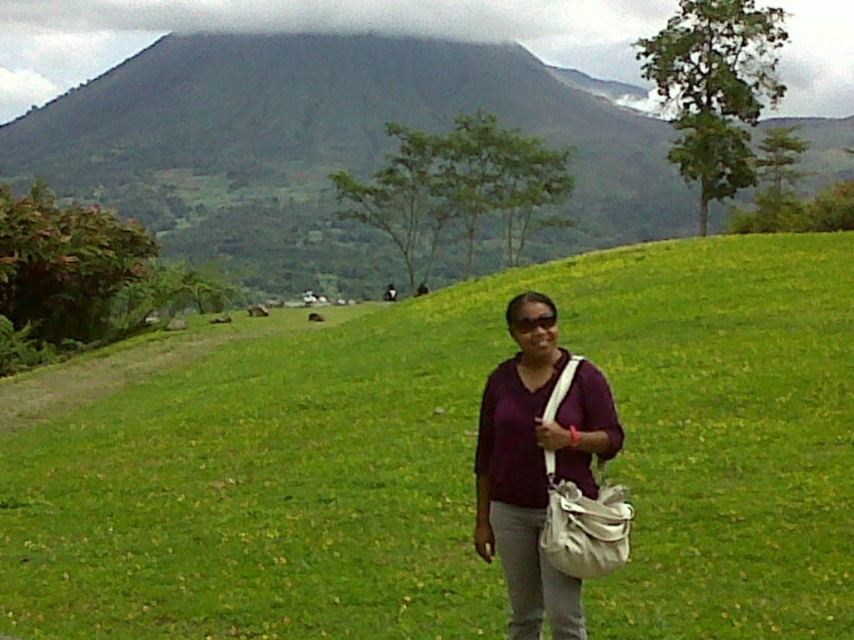
Who is higher up, green grassy field at center or green grassy hillside at center?

green grassy hillside at center is above.

Is green grassy field at center taller than green grassy hillside at center?

Incorrect, green grassy field at center's height is not larger of green grassy hillside at center's.

This screenshot has width=854, height=640. What do you see at coordinates (458, 465) in the screenshot?
I see `green grassy field at center` at bounding box center [458, 465].

Identify the location of green grassy field at center. Image resolution: width=854 pixels, height=640 pixels. (458, 465).

Who is positioned more to the left, green grassy hillside at center or purple matte shirt at center?

green grassy hillside at center

Is point (151, 160) behind point (548, 420)?

Yes, it is.

Which is behind, point (577, 104) or point (528, 628)?

The point (577, 104) is more distant.

Where is `green grassy hillside at center`? This screenshot has width=854, height=640. green grassy hillside at center is located at coordinates (325, 145).

Which is behind, point (636, 424) or point (513, 360)?

Point (636, 424)

Is green grassy field at center to the left of purple matte shirt at center from the viewer's perspective?

No, green grassy field at center is not to the left of purple matte shirt at center.

In order to click on green grassy field at center in this screenshot , I will do tap(458, 465).

Locate an element on the screen. The image size is (854, 640). green grassy field at center is located at coordinates (458, 465).